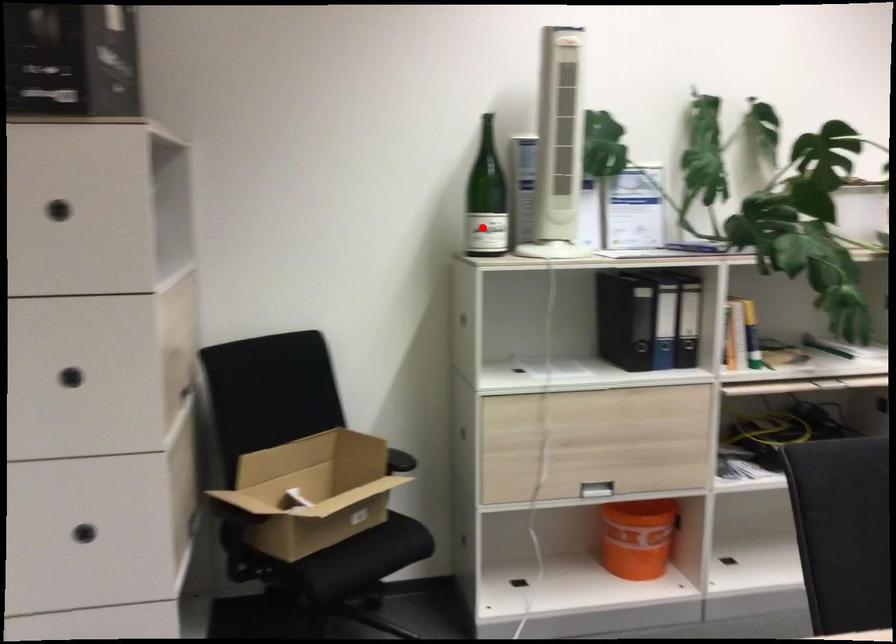
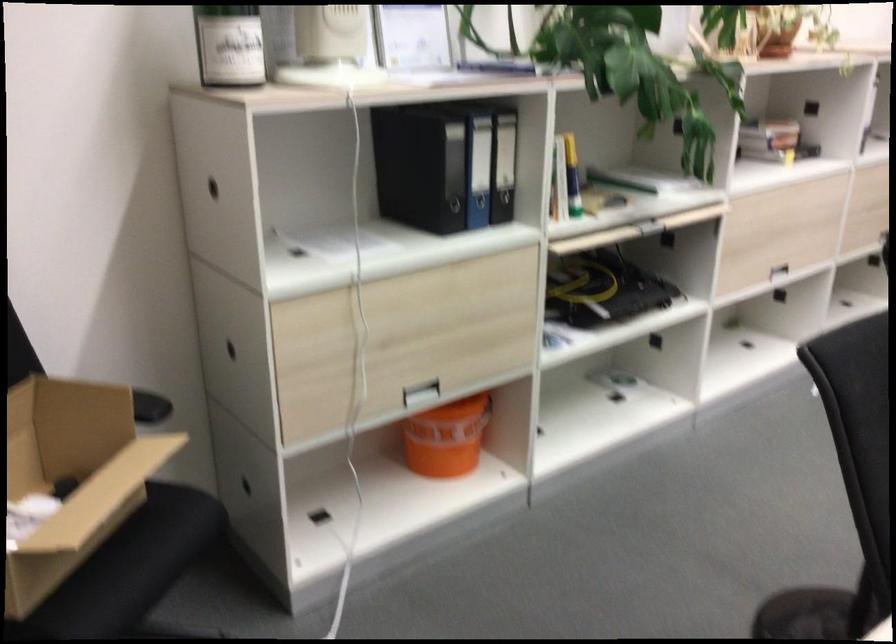
Question: I am providing you with two images of the same scene from different viewpoints. A red point is shown in image1. For the corresponding object point in image2, is it positioned nearer or farther from the camera?

Choices:
 (A) Nearer
 (B) Farther

Answer: (A)